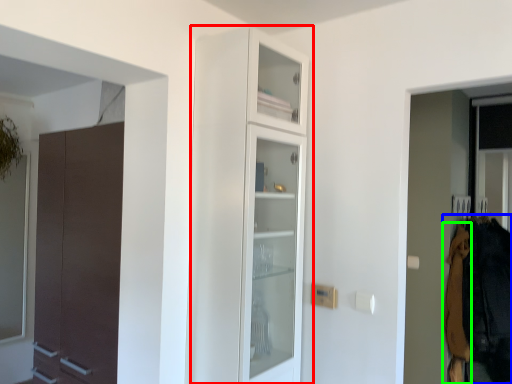
Question: Based on their relative distances, which object is nearer to cupboard (highlighted by a red box)? Choose from clothing (highlighted by a blue box) and clothing (highlighted by a green box).

Choices:
 (A) clothing
 (B) clothing

Answer: (A)